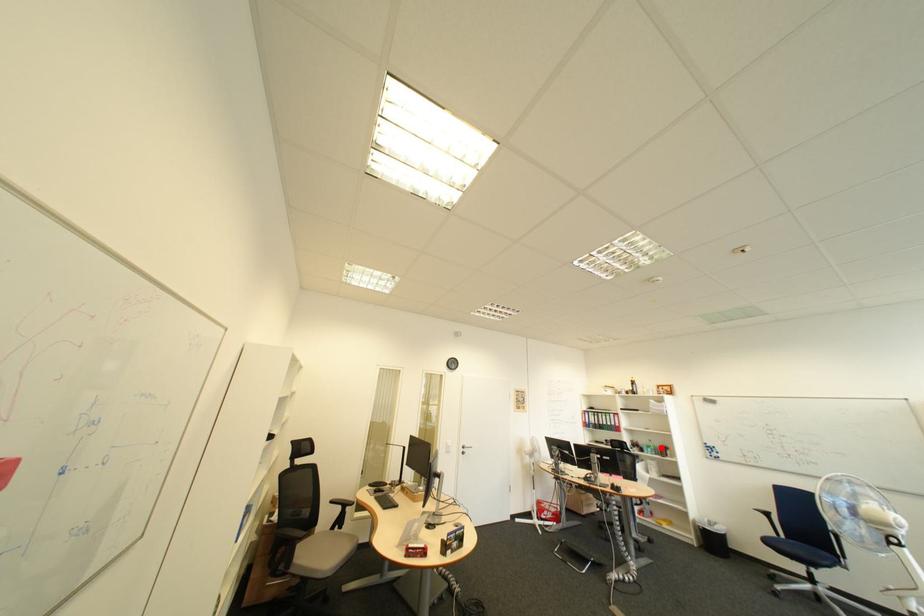
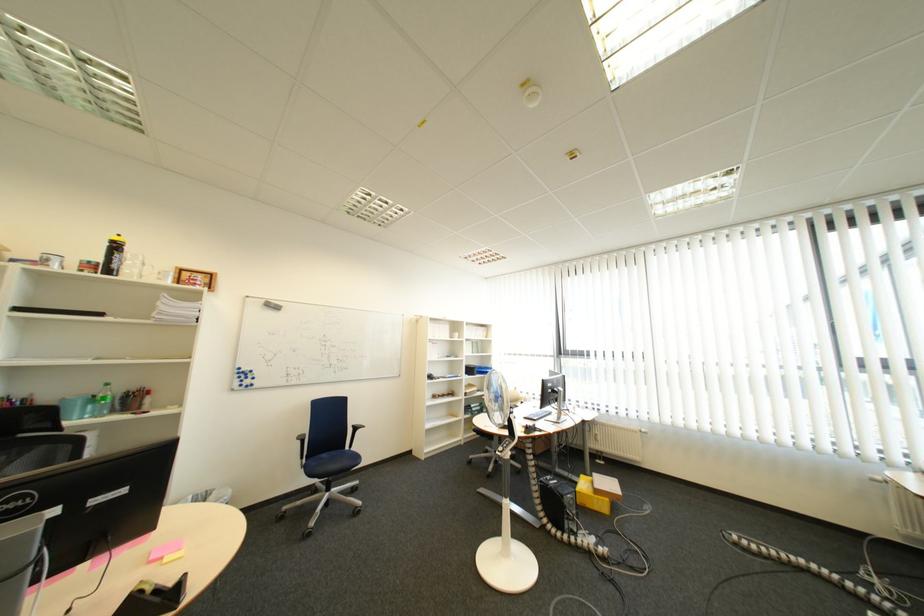
Find the pixel in the second image that matches the highlighted location in the first image.

(105, 400)